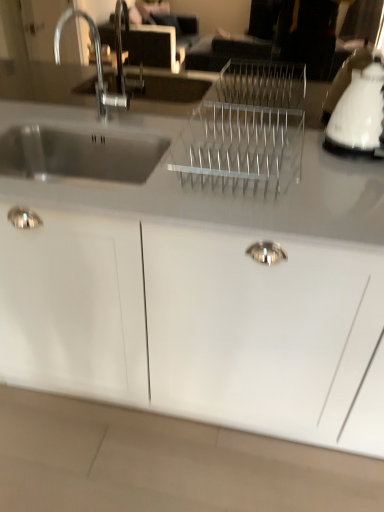
Question: Does white glossy kettle at upper right have a lesser width compared to white glossy cabinet at center?

Choices:
 (A) no
 (B) yes

Answer: (B)

Question: Can you confirm if white glossy kettle at upper right is positioned to the right of white glossy cabinet at center?

Choices:
 (A) no
 (B) yes

Answer: (B)

Question: Is white glossy kettle at upper right positioned beyond the bounds of white glossy cabinet at center?

Choices:
 (A) yes
 (B) no

Answer: (A)

Question: From the image's perspective, is white glossy kettle at upper right over white glossy cabinet at center?

Choices:
 (A) yes
 (B) no

Answer: (A)

Question: Can you confirm if white glossy kettle at upper right is shorter than white glossy cabinet at center?

Choices:
 (A) no
 (B) yes

Answer: (B)

Question: Considering the relative sizes of white glossy kettle at upper right and white glossy cabinet at center in the image provided, is white glossy kettle at upper right wider than white glossy cabinet at center?

Choices:
 (A) yes
 (B) no

Answer: (B)

Question: Can white glossy kettle at upper right be found inside white glossy cabinet at center?

Choices:
 (A) no
 (B) yes

Answer: (A)

Question: Considering the relative positions of white glossy cabinet at center and white glossy kettle at upper right in the image provided, is white glossy cabinet at center behind white glossy kettle at upper right?

Choices:
 (A) yes
 (B) no

Answer: (B)

Question: Is white glossy cabinet at center shorter than white glossy kettle at upper right?

Choices:
 (A) yes
 (B) no

Answer: (B)

Question: Is white glossy cabinet at center positioned with its back to white glossy kettle at upper right?

Choices:
 (A) no
 (B) yes

Answer: (A)

Question: Is white glossy cabinet at center not within white glossy kettle at upper right?

Choices:
 (A) no
 (B) yes

Answer: (B)

Question: Considering the relative sizes of white glossy cabinet at center and white glossy kettle at upper right in the image provided, is white glossy cabinet at center bigger than white glossy kettle at upper right?

Choices:
 (A) no
 (B) yes

Answer: (B)

Question: Is white glossy cabinet at center in front of or behind white glossy kettle at upper right in the image?

Choices:
 (A) front
 (B) behind

Answer: (A)